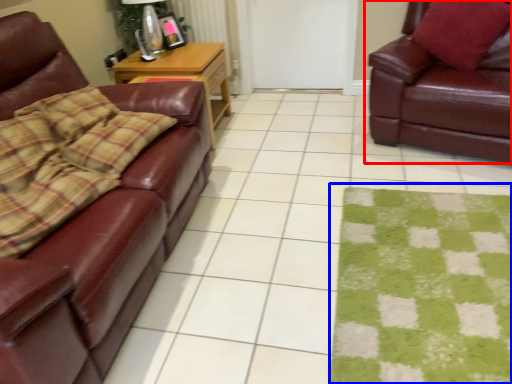
Question: Which point is closer to the camera, studio couch (highlighted by a red box) or mat (highlighted by a blue box)?

Choices:
 (A) studio couch
 (B) mat

Answer: (B)